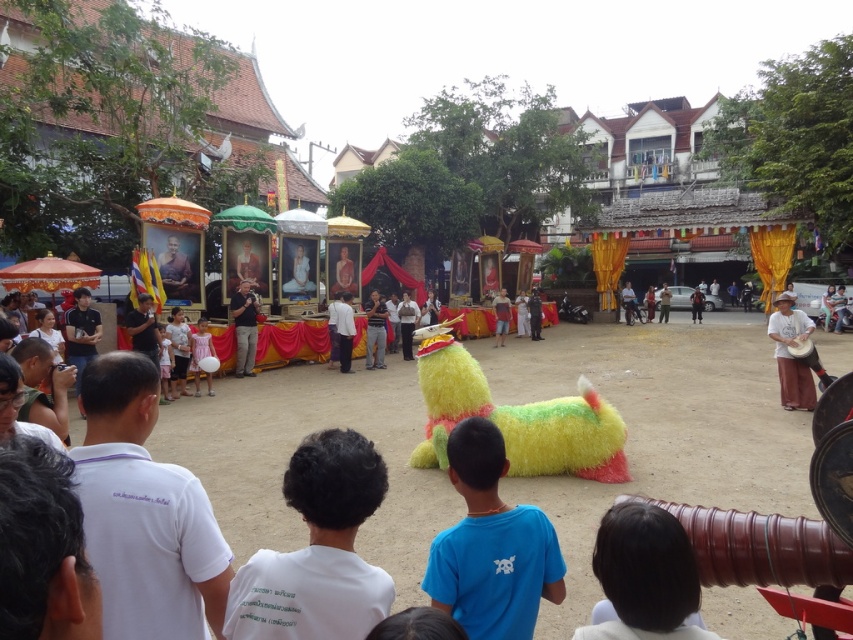
You are standing at the point closest to the dragon figure in the courtyard. There are two points marked in the scene, one at coordinates point (477,632) and another at point (170,369). Which point is closer to you?

Point (477,632) is in front of point (170,369), so it is closer to you.

You are a photographer at the event and want to capture both the blue fuzzy shirt at center and the light pink fabric dress at lower center in a single photo. Which of the two objects is positioned closer to you?

The blue fuzzy shirt at center is closer to the viewer than the light pink fabric dress at lower center, so the blue fuzzy shirt at center would be positioned closer to you.

You are a photographer at the event and want to capture both the fuzzy yellow toy at center and the pink satin dress at center in a single shot. Which object should you focus on first to ensure both are in frame?

The fuzzy yellow toy at center is below the pink satin dress at center, so you should focus on the pink satin dress at center first to ensure both are in frame.